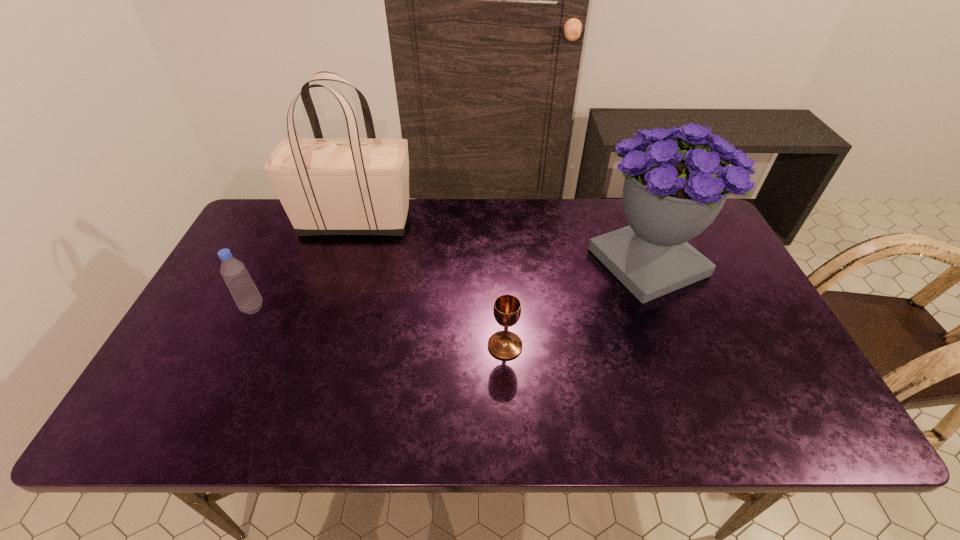
What are the coordinates of `the closest object to the shopping bag` in the screenshot? It's located at (239, 282).

Select which object appears as the third closest to the shopping bag. Please provide its 2D coordinates. Your answer should be formatted as a tuple, i.e. [(x, y)], where the tuple contains the x and y coordinates of a point satisfying the conditions above.

[(671, 194)]

Identify the location of free space in the image that satisfies the following two spatial constraints: 1. with handles facing forward on the shopping bag; 2. on the left side of the nearest object. Image resolution: width=960 pixels, height=540 pixels. (316, 346).

Find the location of a particular element. vacant region that satisfies the following two spatial constraints: 1. on the back side of the second object from right to left; 2. with handles facing forward on the shopping bag is located at coordinates (499, 222).

Find the location of a particular element. This screenshot has width=960, height=540. free location that satisfies the following two spatial constraints: 1. on the back side of the nearest object; 2. with handles facing forward on the shopping bag is located at coordinates (499, 222).

Where is `vacant point that satisfies the following two spatial constraints: 1. with handles facing forward on the rightmost object; 2. on the left side of the shopping bag`? vacant point that satisfies the following two spatial constraints: 1. with handles facing forward on the rightmost object; 2. on the left side of the shopping bag is located at coordinates (343, 262).

The image size is (960, 540). I want to click on vacant area in the image that satisfies the following two spatial constraints: 1. with handles facing forward on the shopping bag; 2. on the left side of the rightmost object, so click(x=343, y=262).

The image size is (960, 540). Identify the location of vacant point that satisfies the following two spatial constraints: 1. with handles facing forward on the shopping bag; 2. on the left side of the rightmost object. (343, 262).